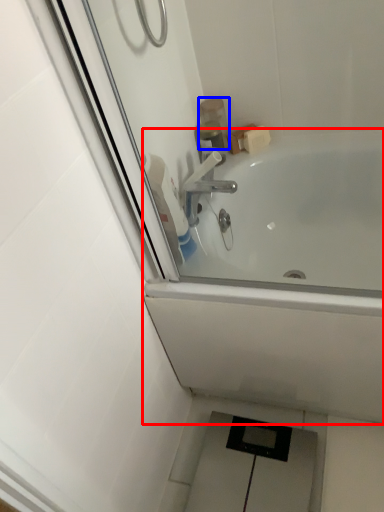
Question: Which point is further to the camera, bathtub (highlighted by a red box) or toiletry (highlighted by a blue box)?

Choices:
 (A) bathtub
 (B) toiletry

Answer: (B)